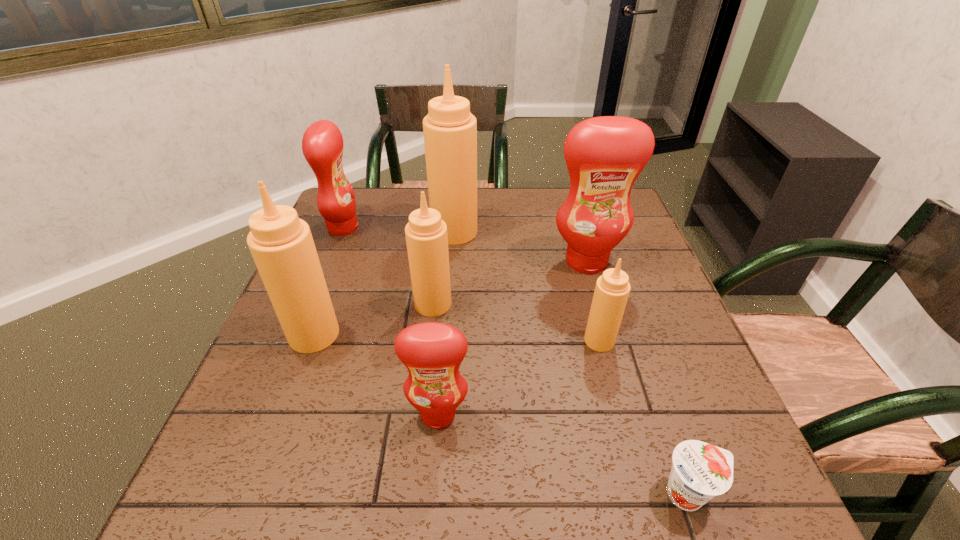
At what (x,y) coordinates should I click in order to perform the action: click on the farthest tan condiment. Please return your answer as a coordinate pair (x, y). Image resolution: width=960 pixels, height=540 pixels. Looking at the image, I should click on (450, 130).

Where is `the tallest condiment`? the tallest condiment is located at coordinates (450, 130).

This screenshot has height=540, width=960. In order to click on the second farthest red condiment in this screenshot , I will do `click(604, 155)`.

Where is `the biggest red condiment`? This screenshot has width=960, height=540. the biggest red condiment is located at coordinates (604, 155).

You are a GUI agent. You are given a task and a screenshot of the screen. Output one action in this format:
    pyautogui.click(x=<x>, y=<y>)
    Task: Click on the second biggest tan condiment
    The width and height of the screenshot is (960, 540).
    Given the screenshot: What is the action you would take?
    pyautogui.click(x=281, y=244)

Image resolution: width=960 pixels, height=540 pixels. What are the coordinates of `the third biggest tan condiment` in the screenshot? It's located at (426, 235).

Find the location of `the leftmost red condiment`. the leftmost red condiment is located at coordinates (322, 144).

Find the location of a particular element. the second smallest red condiment is located at coordinates (322, 144).

The image size is (960, 540). Find the location of `the nearest condiment`. the nearest condiment is located at coordinates (432, 352).

You are a GUI agent. You are given a task and a screenshot of the screen. Output one action in this format:
    pyautogui.click(x=<x>, y=<y>)
    Task: Click on the second red condiment from right to left
    
    Given the screenshot: What is the action you would take?
    pyautogui.click(x=432, y=352)